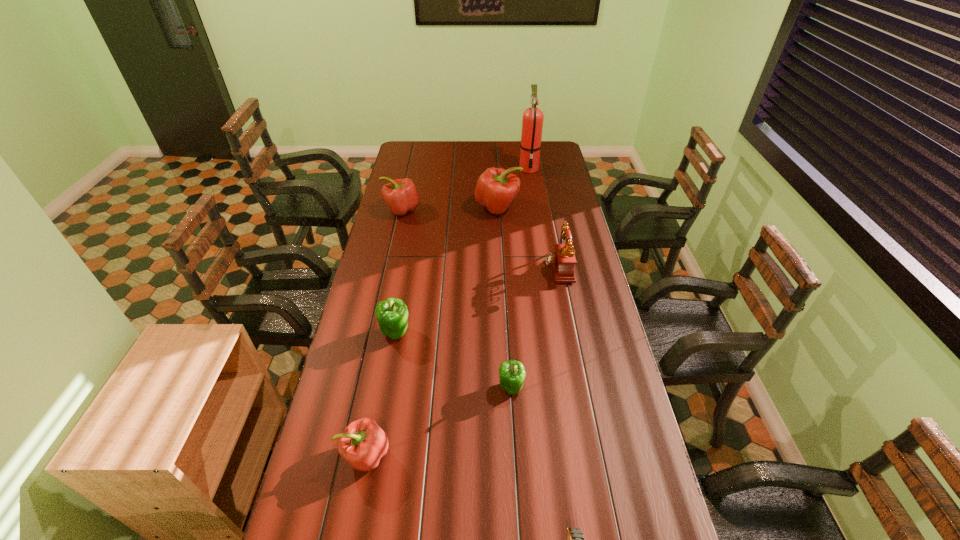
This screenshot has width=960, height=540. What are the coordinates of `object that is at the far edge` in the screenshot? It's located at (532, 121).

Locate an element on the screen. This screenshot has height=540, width=960. fire extinguisher present at the right edge is located at coordinates click(532, 121).

Image resolution: width=960 pixels, height=540 pixels. I want to click on telephone that is at the right edge, so click(562, 260).

Image resolution: width=960 pixels, height=540 pixels. I want to click on object that is positioned at the far right corner, so click(532, 121).

I want to click on free region at the far edge, so click(x=453, y=146).

In the image, there is a desktop. Identify the location of vacant space at the left edge. (389, 250).

Locate an element on the screen. vacant space at the right edge of the desktop is located at coordinates (545, 220).

Locate an element on the screen. This screenshot has height=540, width=960. unoccupied position between the farthest object and the fifth farthest object is located at coordinates (462, 250).

This screenshot has width=960, height=540. What are the coordinates of `vacant region between the second smallest pink bell pepper and the fire extinguisher` in the screenshot? It's located at (465, 189).

The width and height of the screenshot is (960, 540). I want to click on empty space that is in between the farther green bell pepper and the second biggest pink bell pepper, so click(398, 271).